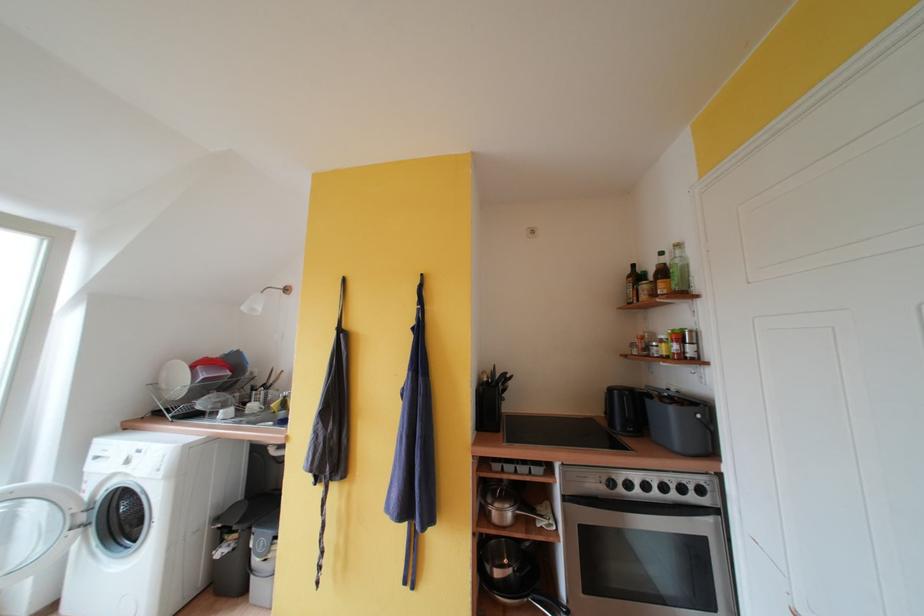
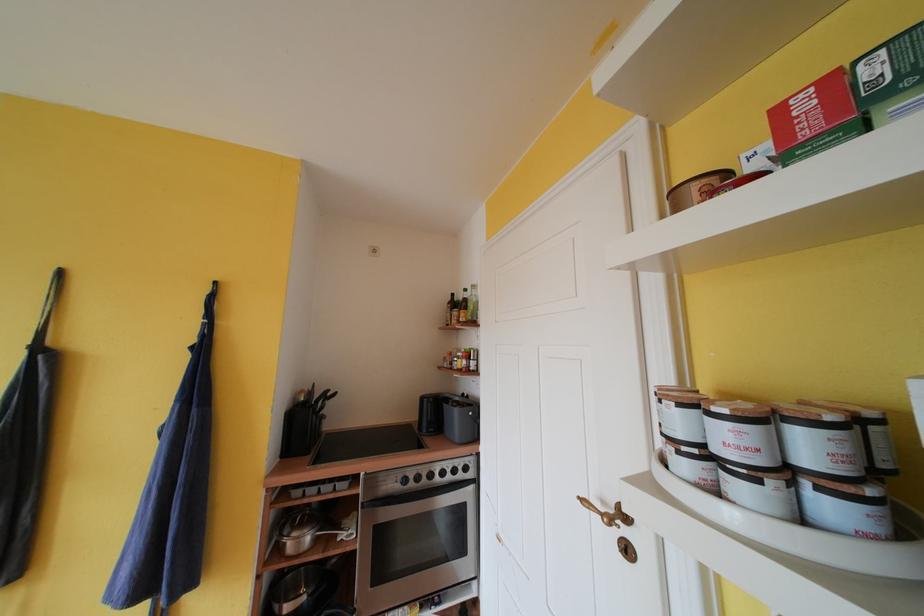
In the second image, find the point that corresponds to [666,257] in the first image.

(471, 294)